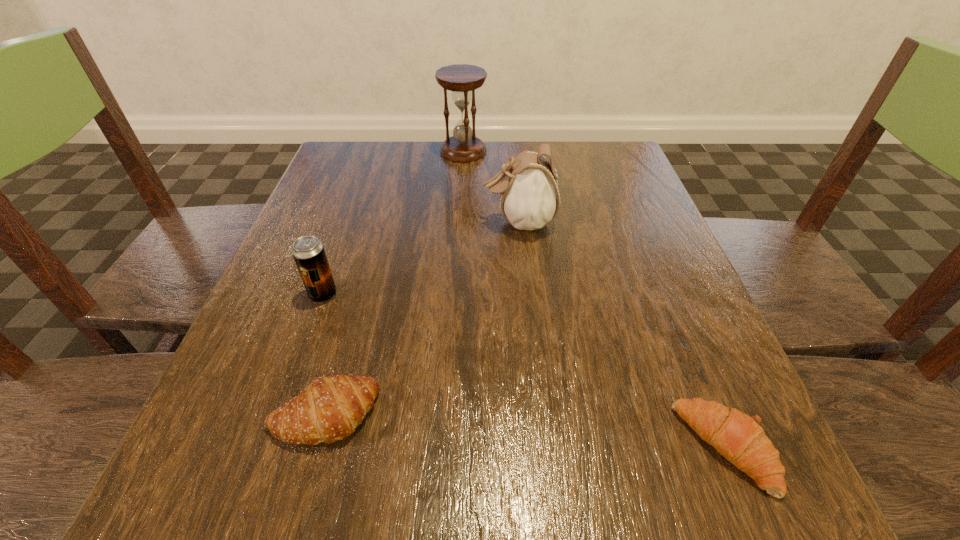
Locate an element on the screen. The image size is (960, 540). object present at the near left corner is located at coordinates (329, 409).

In order to click on object situated at the near right corner in this screenshot , I will do `click(739, 438)`.

The height and width of the screenshot is (540, 960). I want to click on free space at the far edge of the desktop, so click(x=543, y=144).

Where is `blank space at the near edge`? This screenshot has width=960, height=540. blank space at the near edge is located at coordinates (395, 509).

Find the location of a particular element. free space at the left edge is located at coordinates (294, 379).

Locate an element on the screen. Image resolution: width=960 pixels, height=540 pixels. vacant region at the right edge of the desktop is located at coordinates (615, 220).

Where is `free space at the far left corner of the desktop`? The width and height of the screenshot is (960, 540). free space at the far left corner of the desktop is located at coordinates (366, 163).

At what (x,y) coordinates should I click in order to perform the action: click on vacant region at the far right corner of the desktop. Please return your answer as a coordinate pair (x, y). This screenshot has height=540, width=960. Looking at the image, I should click on (572, 163).

Identify the location of vacant point located between the fourth shortest object and the taller crescent roll. (421, 318).

At what (x,y) coordinates should I click in order to perform the action: click on free spot between the shorter crescent roll and the third farthest object. Please return your answer as a coordinate pair (x, y). The image size is (960, 540). Looking at the image, I should click on (524, 372).